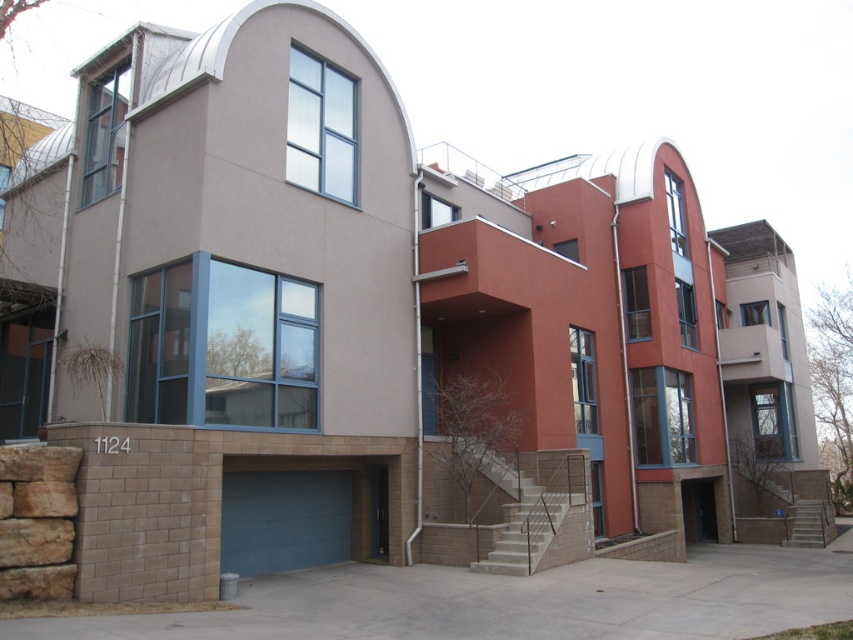
You are standing in front of the residential building and want to determine the relative positions of two points marked on the building. Which point is closer to you, point (553, 476) or point (817, 531)?

Point (553, 476) is closer to the viewer than point (817, 531).

You are a delivery person trying to deliver a package to the address on the stone wall above the garage. You need to know which object is taller to determine the best path. Which is taller between the blue matte garage door at lower left and the smooth concrete stairs at lower right?

The blue matte garage door at lower left is taller than the smooth concrete stairs at lower right, so you should approach the garage door first to reach the address on the stone wall above.